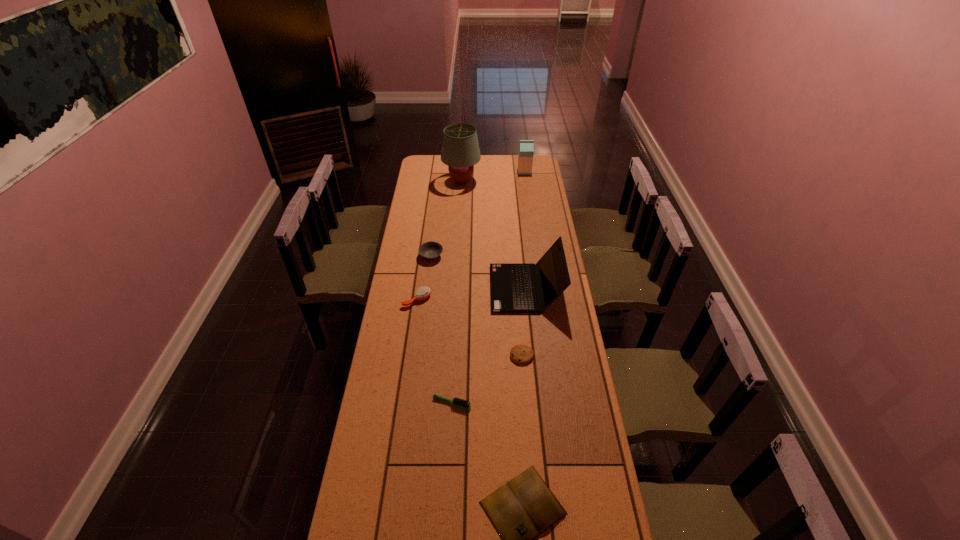
Where is `lampshade`? This screenshot has width=960, height=540. lampshade is located at coordinates (460, 151).

In order to click on milk carton in this screenshot , I will do `click(526, 147)`.

You are a GUI agent. You are given a task and a screenshot of the screen. Output one action in this format:
    pyautogui.click(x=<x>, y=<y>)
    Task: Click on the laptop computer
    This screenshot has height=540, width=960.
    Given the screenshot: What is the action you would take?
    (513, 289)

At what (x,y) coordinates should I click in order to perform the action: click on the sixth nearest object. Please return your answer as a coordinate pair (x, y). Image resolution: width=960 pixels, height=540 pixels. Looking at the image, I should click on (431, 250).

Where is `the left hairbrush`? The width and height of the screenshot is (960, 540). the left hairbrush is located at coordinates (422, 293).

Identify the location of the taller hairbrush. (422, 293).

Locate an element on the screen. the shorter hairbrush is located at coordinates (464, 404).

Find the location of `the nearer hairbrush`. the nearer hairbrush is located at coordinates (464, 404).

Locate an element on the screen. the sixth farthest object is located at coordinates (521, 354).

Find the location of a particular element. free space located 0.390m on the front of the tallest object is located at coordinates (459, 233).